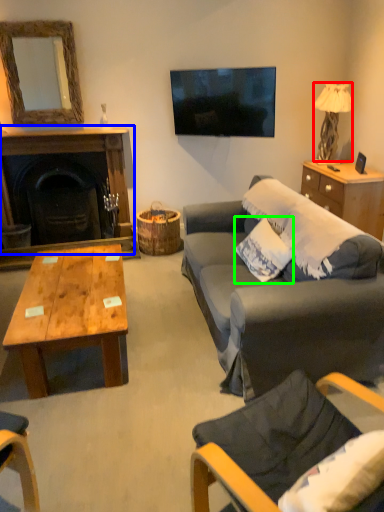
Question: Which object is the closest to the lamp (highlighted by a red box)? Choose among these: fireplace (highlighted by a blue box) or pillow (highlighted by a green box).

Choices:
 (A) fireplace
 (B) pillow

Answer: (B)